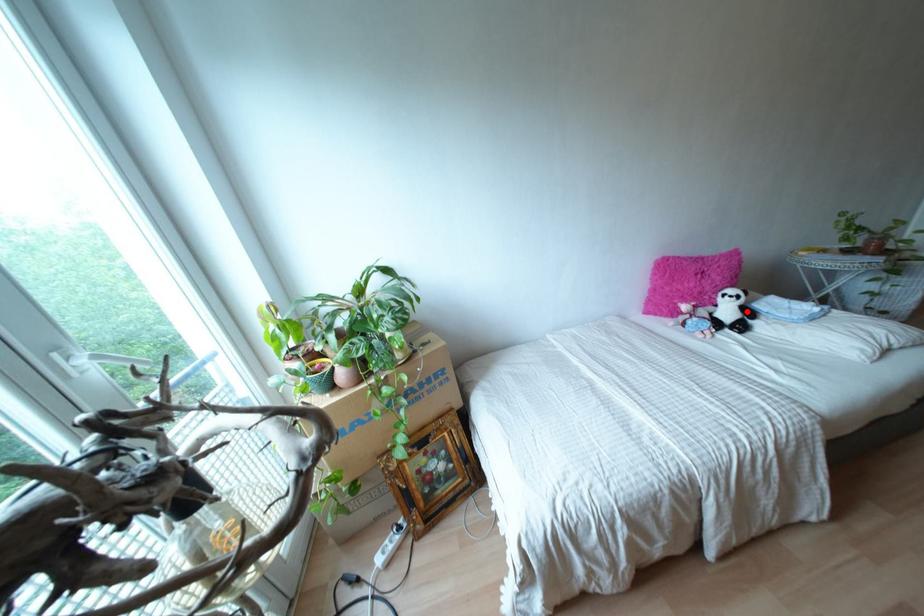
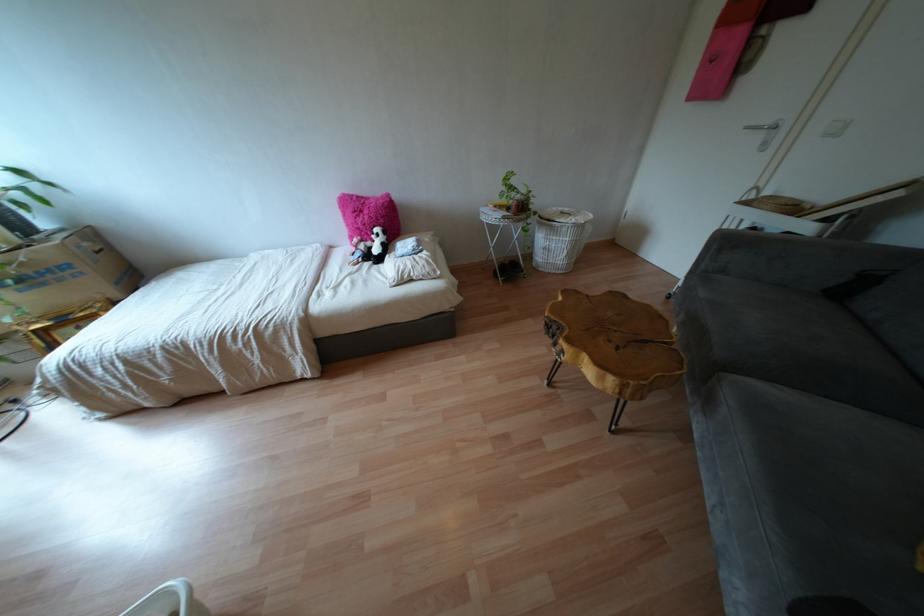
In the second image, find the point that corresponds to the highlighted location in the first image.

(385, 248)